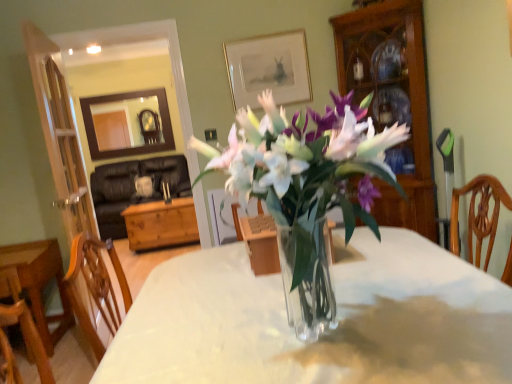
Question: Is wooden cabinet at right located within clear glass vase at center?

Choices:
 (A) no
 (B) yes

Answer: (A)

Question: From a real-world perspective, is clear glass vase at center on top of wooden cabinet at right?

Choices:
 (A) yes
 (B) no

Answer: (B)

Question: Considering the relative sizes of clear glass vase at center and wooden cabinet at right in the image provided, is clear glass vase at center taller than wooden cabinet at right?

Choices:
 (A) yes
 (B) no

Answer: (B)

Question: Is clear glass vase at center oriented towards wooden cabinet at right?

Choices:
 (A) yes
 (B) no

Answer: (B)

Question: Can you confirm if clear glass vase at center is shorter than wooden cabinet at right?

Choices:
 (A) no
 (B) yes

Answer: (B)

Question: Considering the relative positions of clear glass vase at center and gold-framed picture at upper center in the image provided, is clear glass vase at center to the left or to the right of gold-framed picture at upper center?

Choices:
 (A) left
 (B) right

Answer: (B)

Question: From the image's perspective, is clear glass vase at center above or below gold-framed picture at upper center?

Choices:
 (A) below
 (B) above

Answer: (A)

Question: From their relative heights in the image, would you say clear glass vase at center is taller or shorter than gold-framed picture at upper center?

Choices:
 (A) tall
 (B) short

Answer: (A)

Question: From a real-world perspective, is clear glass vase at center above or below gold-framed picture at upper center?

Choices:
 (A) above
 (B) below

Answer: (B)

Question: Is point (415, 153) closer or farther from the camera than point (294, 231)?

Choices:
 (A) closer
 (B) farther

Answer: (B)

Question: Considering their positions, is wooden cabinet at right located in front of or behind clear glass vase at center?

Choices:
 (A) front
 (B) behind

Answer: (B)

Question: Is wooden cabinet at right inside the boundaries of clear glass vase at center, or outside?

Choices:
 (A) outside
 (B) inside

Answer: (A)

Question: From their relative heights in the image, would you say wooden cabinet at right is taller or shorter than clear glass vase at center?

Choices:
 (A) short
 (B) tall

Answer: (B)

Question: Is point (373, 89) closer or farther from the camera than point (289, 79)?

Choices:
 (A) closer
 (B) farther

Answer: (B)

Question: Looking at their shapes, would you say wooden cabinet at right is wider or thinner than gold-framed picture at upper center?

Choices:
 (A) thin
 (B) wide

Answer: (B)